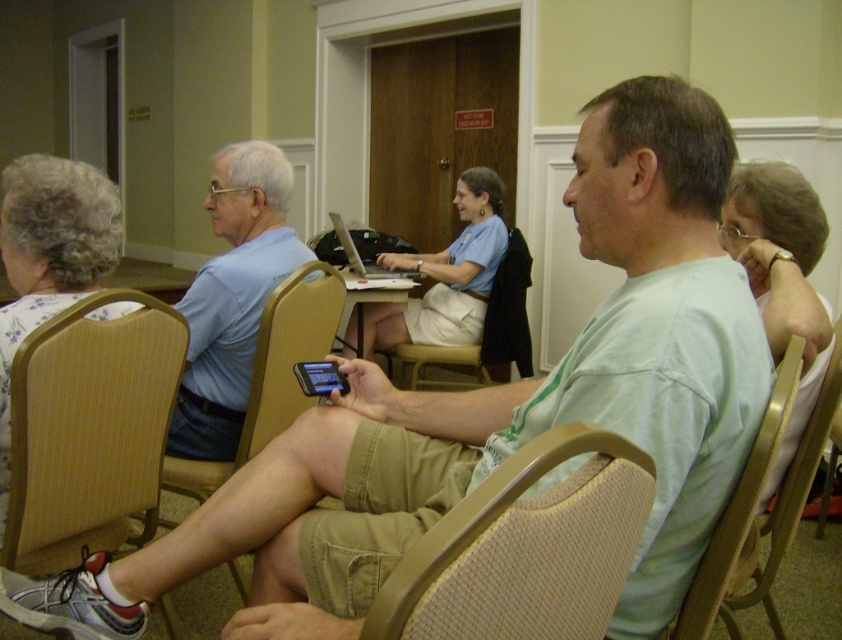
You are a person sitting in the beige woven fabric chair at lower center and want to move to the tan fabric chair at lower center. Is there enough space to move directly to it without needing to move any furniture?

The beige woven fabric chair at lower center is positioned over the tan fabric chair at lower center, so there is no space between them. You would need to move the beige woven fabric chair at lower center first before sitting on the tan fabric chair at lower center.

Based on the scene description, where is the light blue shirt at upper left located in terms of its 2D coordinates?

The light blue shirt at upper left is located at the 2D coordinates of point (232, 298).

You are organizing a small workshop and need to ensure that the black glossy smartphone at center can fit on the beige woven fabric chair at lower center without hanging off the edges. Based on the scene description, can you confirm if the smartphone will fit?

The beige woven fabric chair at lower center is wider than the black glossy smartphone at center, so the smartphone should fit comfortably on the chair without hanging off the edges.